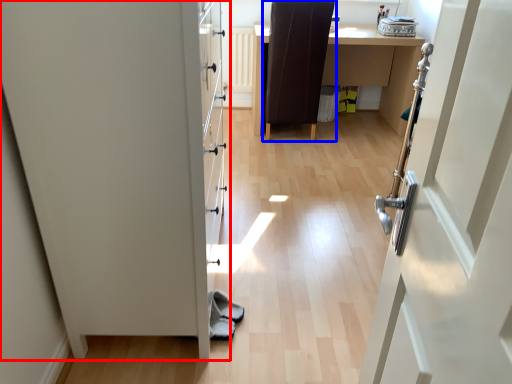
Question: Which of the following is the closest to the observer, door (highlighted by a red box) or chair (highlighted by a blue box)?

Choices:
 (A) door
 (B) chair

Answer: (A)